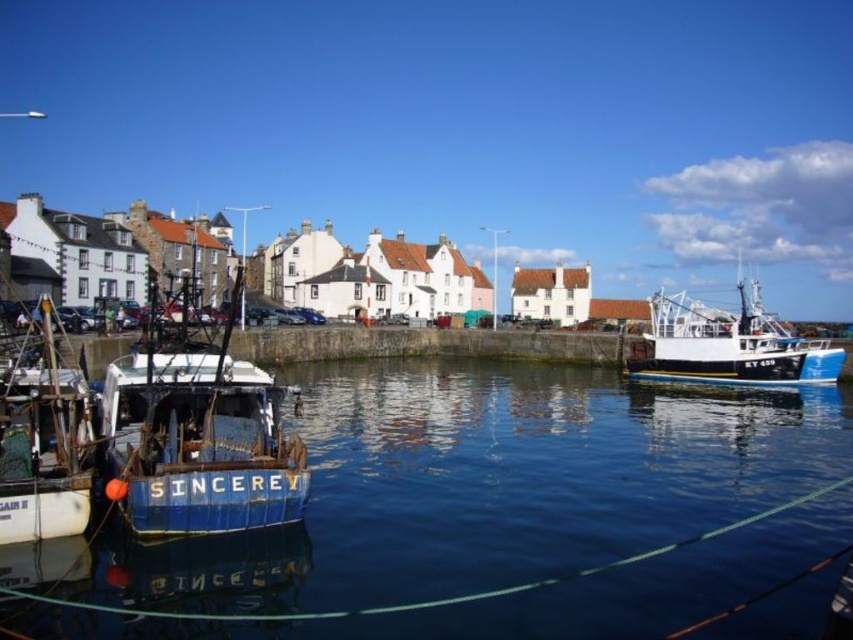
Question: Does blue glossy water at center lie in front of blue matte boat at left?

Choices:
 (A) no
 (B) yes

Answer: (B)

Question: Which point is farther to the camera?

Choices:
 (A) click(680, 580)
 (B) click(144, 397)

Answer: (B)

Question: Which object appears farthest from the camera in this image?

Choices:
 (A) blue matte boat at left
 (B) blue glossy water at center
 (C) blue painted wooden fishing boat at right
 (D) blue wooden boat at left

Answer: (C)

Question: Where is blue wooden boat at left located in relation to blue painted wooden fishing boat at right in the image?

Choices:
 (A) right
 (B) left

Answer: (B)

Question: Among these objects, which one is nearest to the camera?

Choices:
 (A) blue matte boat at left
 (B) blue wooden boat at left
 (C) blue glossy water at center
 (D) blue painted wooden fishing boat at right

Answer: (C)

Question: Can you confirm if blue matte boat at left is positioned to the left of blue wooden boat at left?

Choices:
 (A) no
 (B) yes

Answer: (A)